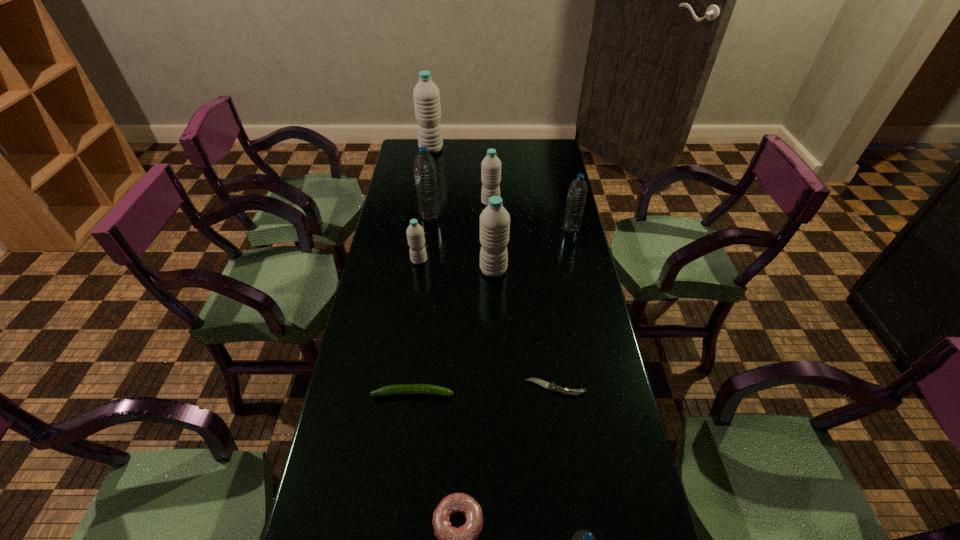
At what (x,y) coordinates should I click in order to perform the action: click on free space between the farthest white water bottle and the second biggest blue water bottle. Please return your answer as a coordinate pair (x, y). This screenshot has width=960, height=540. Looking at the image, I should click on (501, 189).

Where is `vacant space that is in between the third farthest object and the second smallest white water bottle`? vacant space that is in between the third farthest object and the second smallest white water bottle is located at coordinates (460, 210).

Find the location of a particular element. free spot between the second farthest object and the rightmost object is located at coordinates (531, 216).

Identify the location of vacant space in between the zucchini and the farthest object. The image size is (960, 540). (422, 272).

Identify the location of free space between the third smallest white water bottle and the tallest water bottle. (463, 210).

The image size is (960, 540). I want to click on the third closest object relative to the farthest white water bottle, so click(415, 234).

Where is `object that stands as the fourth closest to the farthest white water bottle`? object that stands as the fourth closest to the farthest white water bottle is located at coordinates (577, 193).

Select which water bottle appears as the fourth closest to the pocketknife. Please provide its 2D coordinates. Your answer should be formatted as a tuple, i.e. [(x, y)], where the tuple contains the x and y coordinates of a point satisfying the conditions above.

[(577, 193)]

You are a GUI agent. You are given a task and a screenshot of the screen. Output one action in this format:
    pyautogui.click(x=<x>, y=<y>)
    Task: Click on the water bottle identified as the second closest to the second smallest blue water bottle
    The height and width of the screenshot is (540, 960).
    Given the screenshot: What is the action you would take?
    pyautogui.click(x=494, y=220)

Locate which white water bottle ranks second in proximity to the shortest object. Please provide its 2D coordinates. Your answer should be formatted as a tuple, i.e. [(x, y)], where the tuple contains the x and y coordinates of a point satisfying the conditions above.

[(415, 234)]